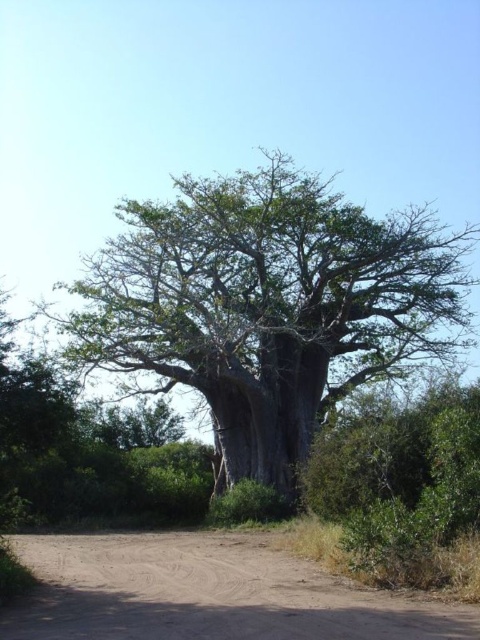
Question: Does green rough bark tree at center have a greater width compared to brown sandy dirt track at lower center?

Choices:
 (A) yes
 (B) no

Answer: (A)

Question: Considering the relative positions of green rough bark tree at center and brown sandy dirt track at lower center in the image provided, where is green rough bark tree at center located with respect to brown sandy dirt track at lower center?

Choices:
 (A) below
 (B) above

Answer: (B)

Question: Among these points, which one is nearest to the camera?

Choices:
 (A) (156, 214)
 (B) (46, 588)

Answer: (B)

Question: Is green rough bark tree at center smaller than brown sandy dirt track at lower center?

Choices:
 (A) no
 (B) yes

Answer: (A)

Question: Which point appears closest to the camera in this image?

Choices:
 (A) (311, 588)
 (B) (175, 276)

Answer: (A)

Question: Which point is closer to the camera?

Choices:
 (A) (101, 252)
 (B) (239, 576)

Answer: (B)